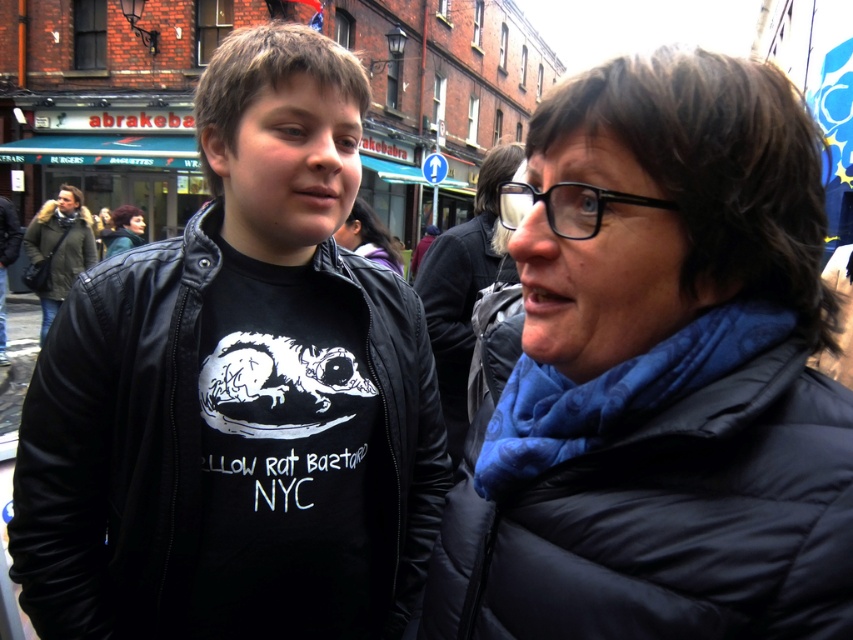
Is matte black jacket at center shorter than dark brown hair at center?

No.

Does matte black jacket at center appear under dark brown hair at center?

Yes.

Is point (151, 618) positioned in front of point (135, 212)?

That is True.

This screenshot has height=640, width=853. In order to click on matte black jacket at center in this screenshot , I will do `click(238, 394)`.

Is matte black jacket at center positioned at the back of green fuzzy coat at left?

No, matte black jacket at center is in front of green fuzzy coat at left.

Who is more forward, (289,180) or (77,216)?

Positioned in front is point (289,180).

Identify the location of matte black jacket at center. (238, 394).

How distant is black puffy jacket at right from blue fleece scarf at upper right?

black puffy jacket at right is 3.11 meters away from blue fleece scarf at upper right.

Who is more distant from viewer, (792, 387) or (381, 243)?

The point (381, 243) is more distant.

Where is `black puffy jacket at right`? The height and width of the screenshot is (640, 853). black puffy jacket at right is located at coordinates (657, 497).